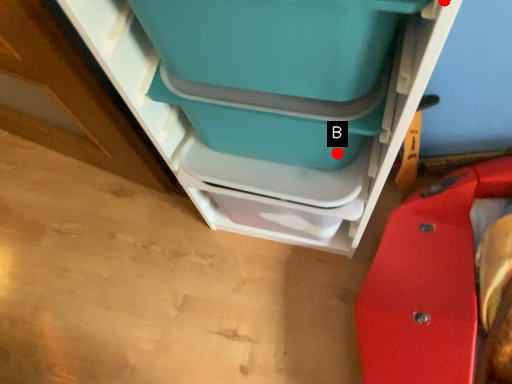
Question: Two points are circled on the image, labeled by A and B beside each circle. Which point appears closest to the camera in this image?

Choices:
 (A) A is closer
 (B) B is closer

Answer: (A)